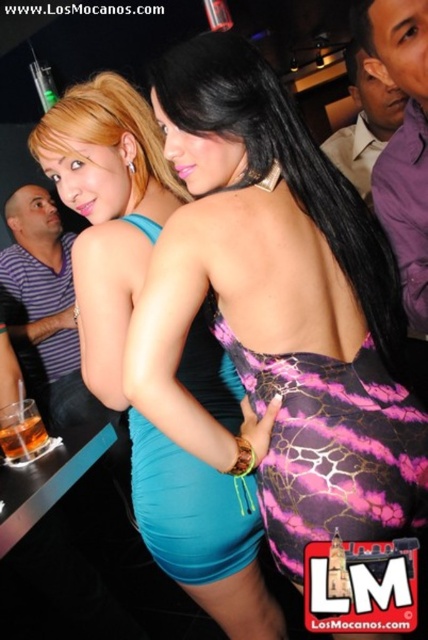
Does pink leopard print dress at back lie behind striped shirt at left?

That is False.

Is pink leopard print dress at back above striped shirt at left?

No, pink leopard print dress at back is not above striped shirt at left.

Locate an element on the screen. The width and height of the screenshot is (428, 640). pink leopard print dress at back is located at coordinates (335, 451).

Between blue satin dress at center and striped shirt at left, which one is positioned higher?

striped shirt at left is above.

Can you confirm if blue satin dress at center is bigger than striped shirt at left?

No, blue satin dress at center is not bigger than striped shirt at left.

This screenshot has height=640, width=428. What are the coordinates of `blue satin dress at center` in the screenshot? It's located at (124, 342).

Can you confirm if blue satin dress at center is positioned to the right of purple shirt at upper right?

Incorrect, blue satin dress at center is not on the right side of purple shirt at upper right.

In the scene shown: Does blue satin dress at center have a greater height compared to purple shirt at upper right?

Indeed, blue satin dress at center has a greater height compared to purple shirt at upper right.

Find the location of a particular element. The height and width of the screenshot is (640, 428). blue satin dress at center is located at coordinates (124, 342).